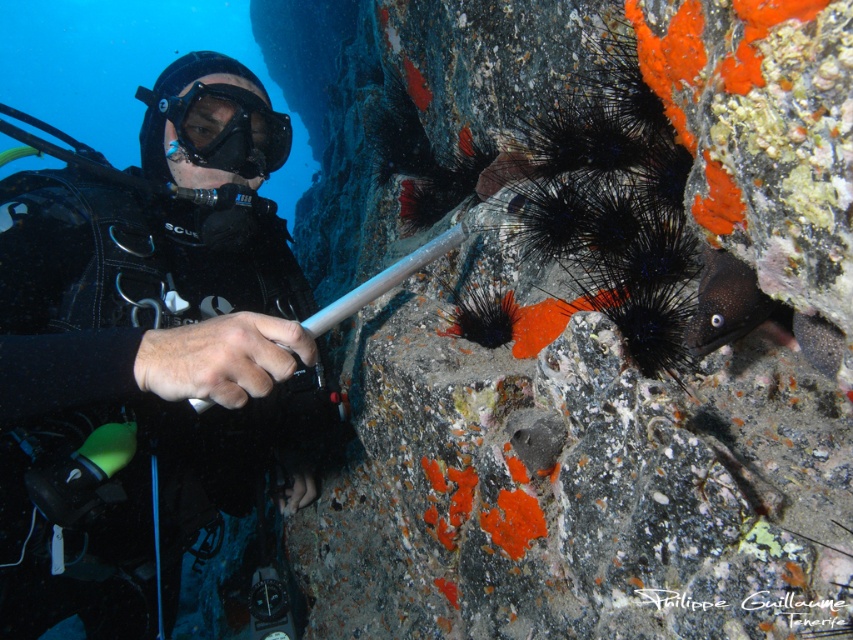
Question: From the image, what is the correct spatial relationship of black matte diving suit at left in relation to transparent rubber goggles at center?

Choices:
 (A) below
 (B) above

Answer: (A)

Question: Which point is closer to the camera taking this photo?

Choices:
 (A) (144, 93)
 (B) (135, 316)

Answer: (B)

Question: Does black matte diving suit at left lie in front of transparent rubber goggles at center?

Choices:
 (A) yes
 (B) no

Answer: (A)

Question: Considering the relative positions of black matte diving suit at left and transparent rubber goggles at center in the image provided, where is black matte diving suit at left located with respect to transparent rubber goggles at center?

Choices:
 (A) above
 (B) below

Answer: (B)